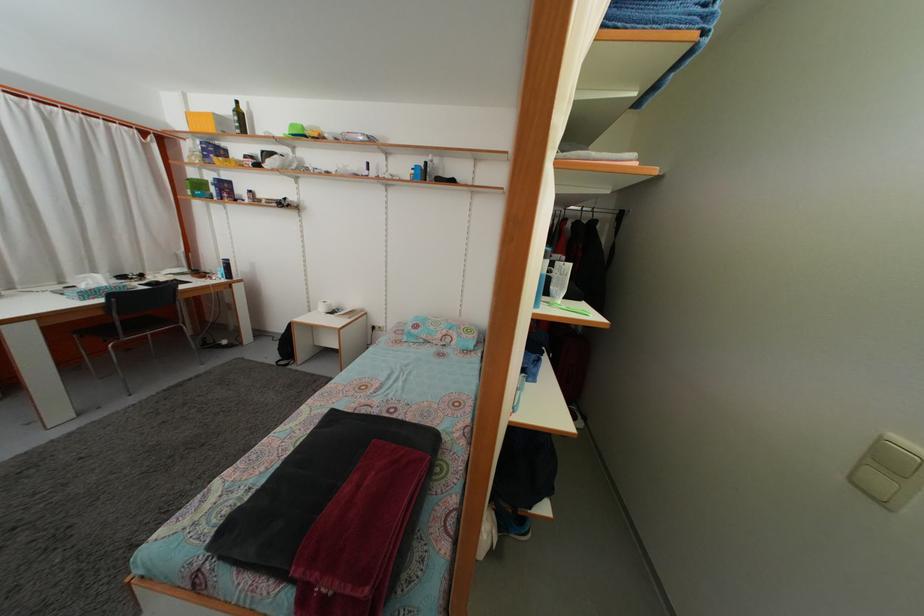
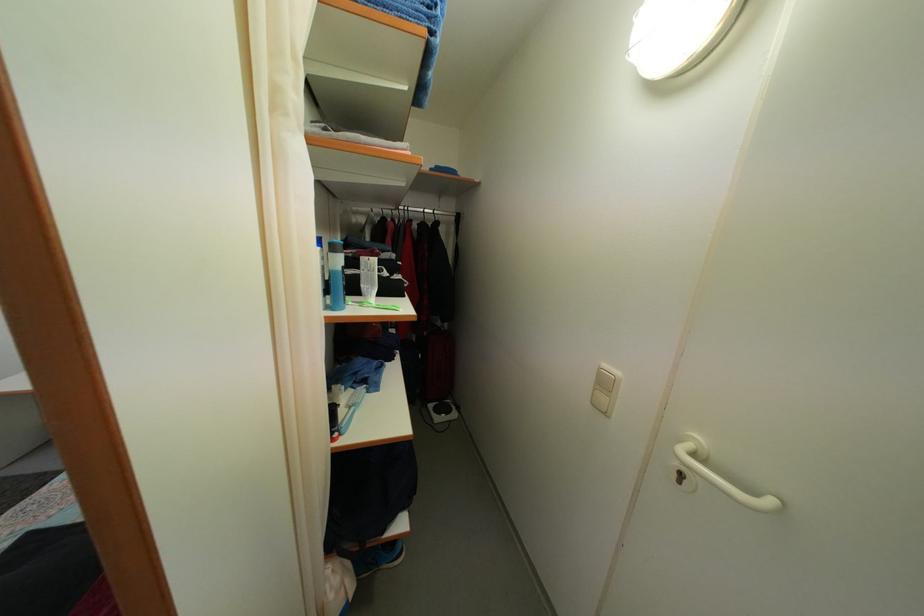
Question: The first image is from the beginning of the video and the second image is from the end. How did the camera likely rotate when shooting the video?

Choices:
 (A) Left
 (B) Right
 (C) Up
 (D) Down

Answer: (B)